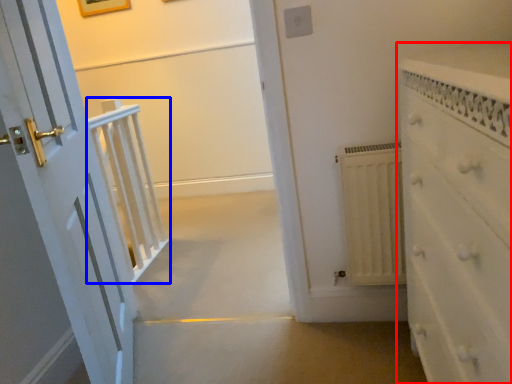
Question: Which of the following is the farthest to the observer, chest of drawers (highlighted by a red box) or balustrade (highlighted by a blue box)?

Choices:
 (A) chest of drawers
 (B) balustrade

Answer: (B)